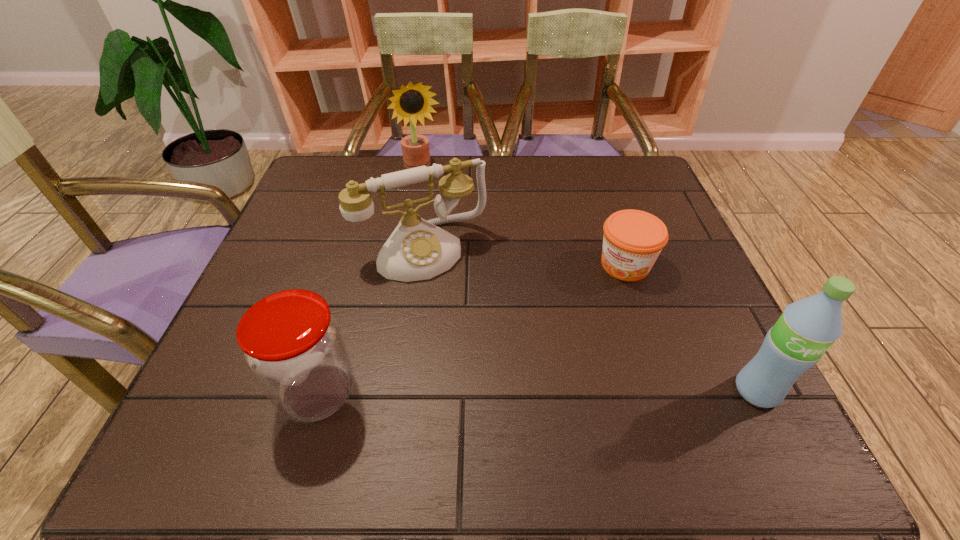
This screenshot has width=960, height=540. In order to click on vacant region located 0.130m on the front label of the shortest object in this screenshot , I will do `click(583, 319)`.

Identify the location of vacant region located 0.380m on the face of the sunflower. (453, 272).

Identify the location of vacant space located on the face of the sunflower. The image size is (960, 540). (443, 235).

You are a GUI agent. You are given a task and a screenshot of the screen. Output one action in this format:
    pyautogui.click(x=<x>, y=<y>)
    Task: Click on the vacant space located on the face of the sunflower
    This screenshot has height=540, width=960.
    Given the screenshot: What is the action you would take?
    pyautogui.click(x=451, y=266)

Identify the location of vacant space located on the dial of the telephone. The image size is (960, 540). (493, 370).

Find the location of `blank area located on the dial of the telephone`. blank area located on the dial of the telephone is located at coordinates (472, 330).

This screenshot has width=960, height=540. I want to click on free region located 0.270m on the dial of the telephone, so click(x=498, y=380).

Locate an element on the screen. The width and height of the screenshot is (960, 540). object at the far edge is located at coordinates (412, 102).

The height and width of the screenshot is (540, 960). Identify the location of jar located at the near edge. (293, 345).

Locate an element on the screen. This screenshot has width=960, height=540. water bottle that is at the near edge is located at coordinates (807, 328).